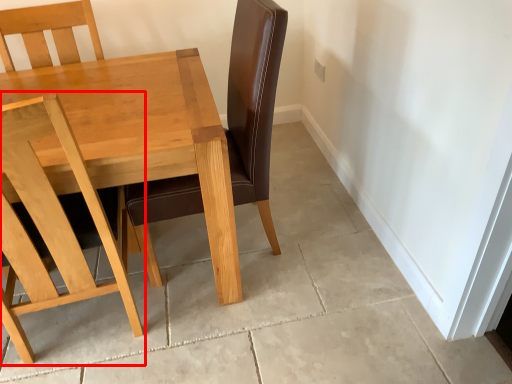
Question: From the image's perspective, where is chair (annotated by the red box) located relative to table?

Choices:
 (A) below
 (B) above

Answer: (A)